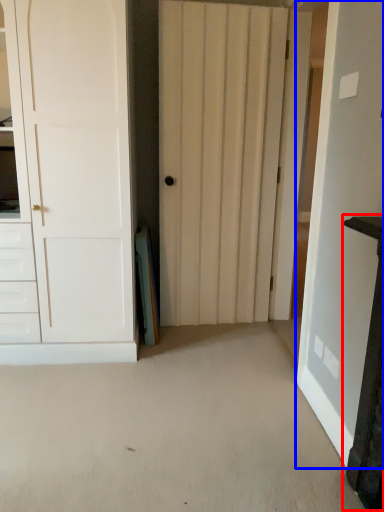
Question: Which object appears farthest to the camera in this image, vanity (highlighted by a red box) or door (highlighted by a blue box)?

Choices:
 (A) vanity
 (B) door

Answer: (B)